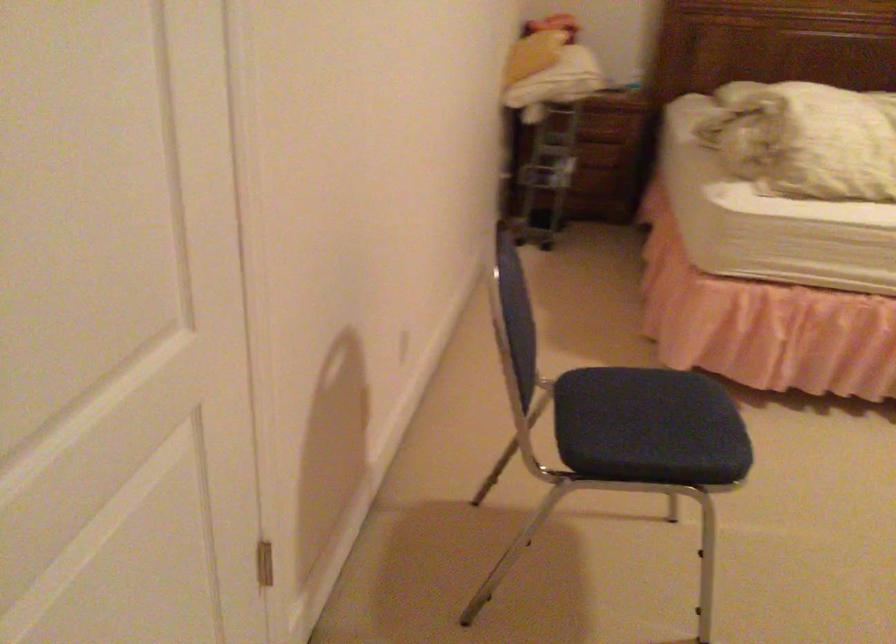
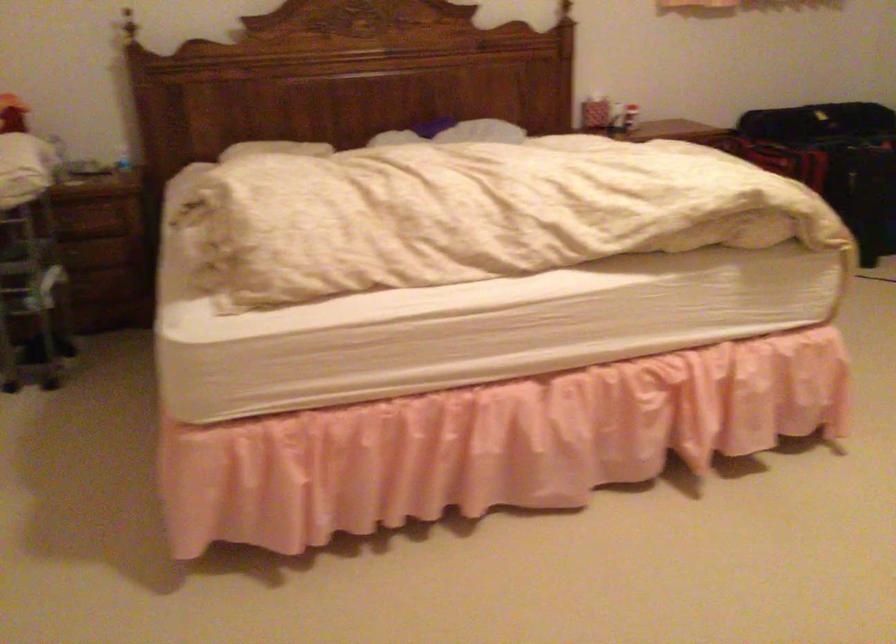
Question: How did the camera likely rotate?

Choices:
 (A) Left
 (B) Right
 (C) Up
 (D) Down

Answer: (B)